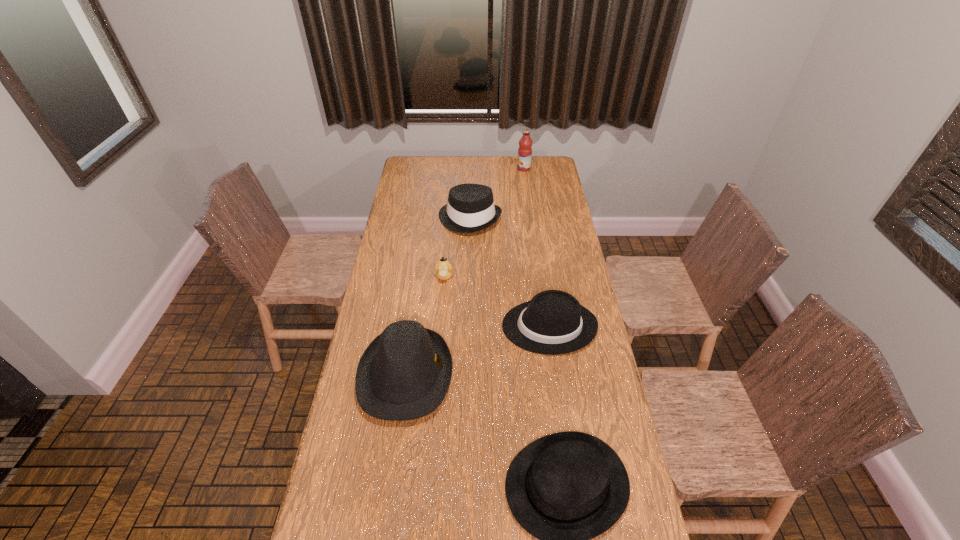
Find the location of a particular element. This screenshot has width=960, height=540. the tallest object is located at coordinates (525, 143).

Locate an element on the screen. The image size is (960, 540). fruit juice is located at coordinates (525, 143).

Identify the location of the farthest fedora. (470, 208).

Where is `the third shortest object`? The width and height of the screenshot is (960, 540). the third shortest object is located at coordinates (553, 322).

In order to click on the third farthest object in this screenshot , I will do `click(443, 268)`.

The image size is (960, 540). In order to click on blank area located 0.130m on the front label of the farthest object in this screenshot , I will do `click(493, 168)`.

Find the location of a particular element. This screenshot has width=960, height=540. vacant area located 0.080m on the front label of the farthest object is located at coordinates (502, 168).

What are the coordinates of `vacant space located on the front label of the farthest object` in the screenshot? It's located at (502, 168).

Where is `vacant region located on the back of the farthest fedora`? Image resolution: width=960 pixels, height=540 pixels. vacant region located on the back of the farthest fedora is located at coordinates (471, 179).

Identify the location of free space located on the front-facing side of the third shortest object. (432, 326).